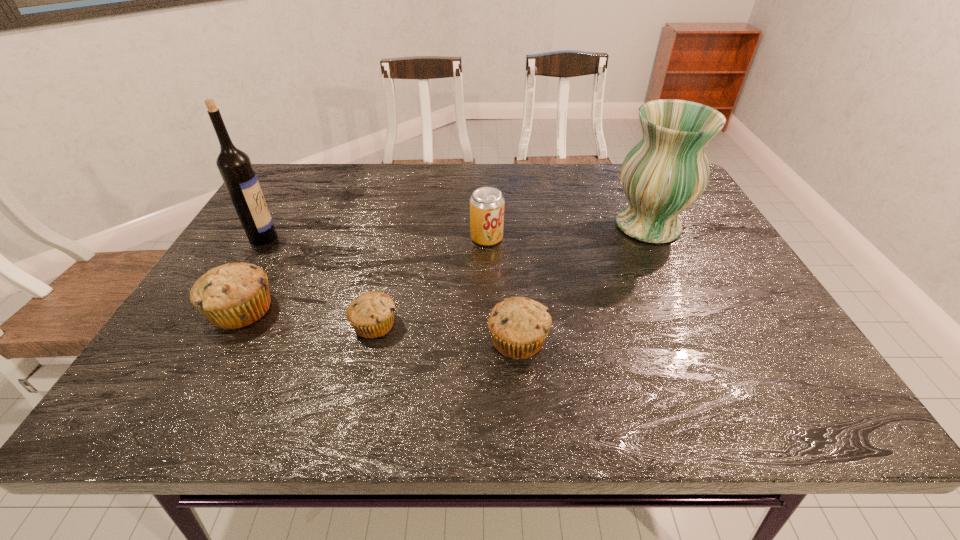
Image resolution: width=960 pixels, height=540 pixels. Find the location of `the tallest muffin`. the tallest muffin is located at coordinates (234, 295).

Locate an element on the screen. The width and height of the screenshot is (960, 540). the second muffin from left to right is located at coordinates (371, 314).

The image size is (960, 540). I want to click on the shortest object, so click(371, 314).

This screenshot has height=540, width=960. Find the location of `the rightmost muffin`. the rightmost muffin is located at coordinates (519, 326).

This screenshot has width=960, height=540. I want to click on the second tallest muffin, so click(519, 326).

Where is `vase`? Image resolution: width=960 pixels, height=540 pixels. vase is located at coordinates (667, 171).

The width and height of the screenshot is (960, 540). Identify the location of the rightmost object. (667, 171).

Identify the location of wine bottle. This screenshot has width=960, height=540. (234, 165).

Locate an element on the screen. The height and width of the screenshot is (540, 960). pop (soda) is located at coordinates (486, 203).

The width and height of the screenshot is (960, 540). What are the coordinates of `vacant space located on the back of the tallest muffin` in the screenshot? It's located at (298, 208).